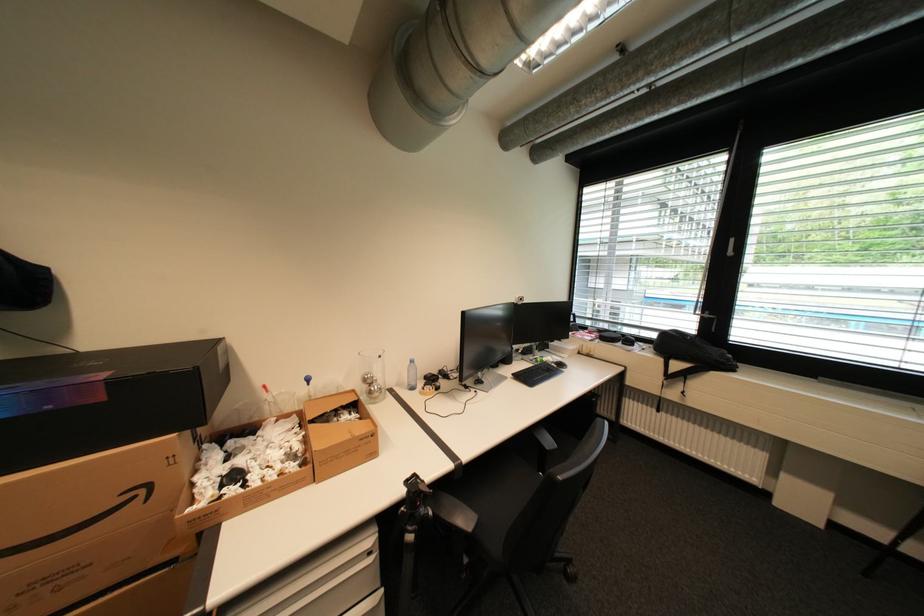
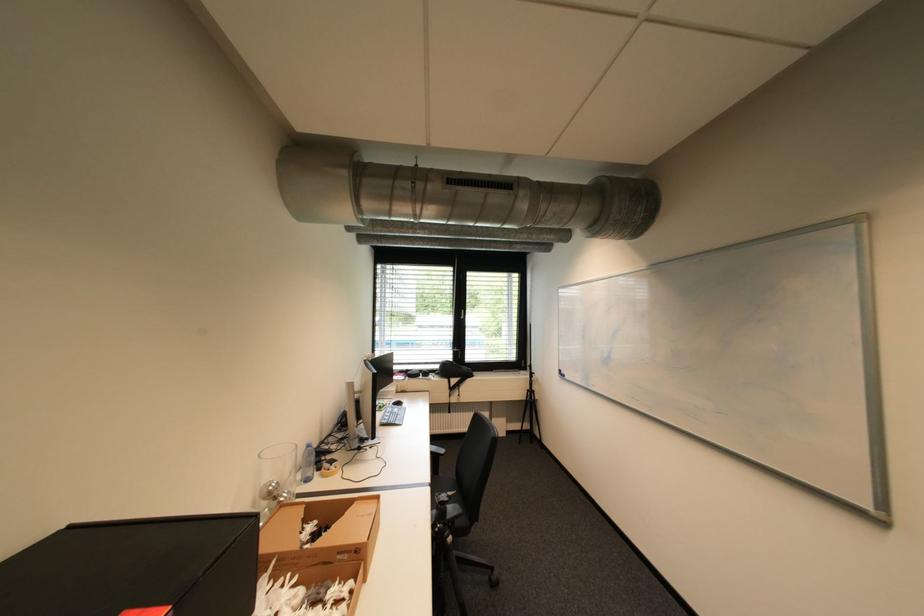
Where in the second image is the point corresponding to the point at 419,538 from the first image?

(458, 540)